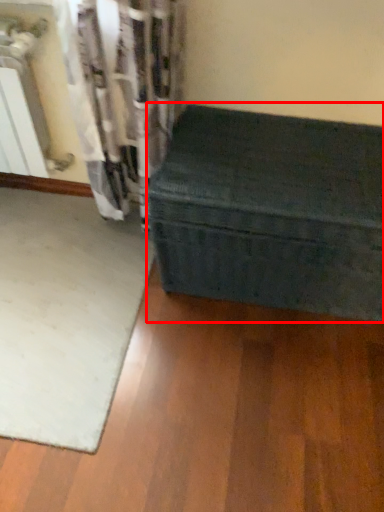
Question: From the image's perspective, where is furniture (annotated by the red box) located relative to mat?

Choices:
 (A) above
 (B) below

Answer: (A)